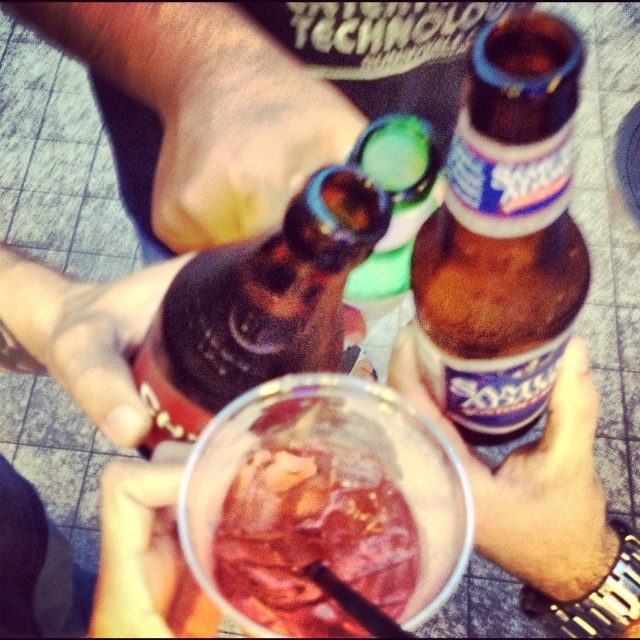
Which is in front, point (572, 474) or point (376, 248)?

Positioned in front is point (572, 474).

Does matte brown bottle at center have a greater width compared to green glass bottle at center?

Correct, the width of matte brown bottle at center exceeds that of green glass bottle at center.

Does point (592, 410) come closer to viewer compared to point (358, 289)?

Yes.

Find the location of `matte brown bottle at center`. matte brown bottle at center is located at coordinates (532, 483).

Is point (506, 401) farther from camera compared to point (410, 531)?

No, it is in front of (410, 531).

Is brown glass bottle at upper center thinner than translucent glass drink at center?

Yes, brown glass bottle at upper center is thinner than translucent glass drink at center.

Does point (470, 76) come farther from viewer compared to point (307, 634)?

No, (470, 76) is in front of (307, 634).

Find the location of a particular element. The width and height of the screenshot is (640, 640). brown glass bottle at upper center is located at coordinates (502, 230).

Between translucent glass drink at center and matte black hand at center, which one has less height?

With less height is translucent glass drink at center.

Can you confirm if translucent glass drink at center is wider than matte black hand at center?

In fact, translucent glass drink at center might be narrower than matte black hand at center.

Is point (340, 508) more distant than point (189, 189)?

Yes, point (340, 508) is behind point (189, 189).

Image resolution: width=640 pixels, height=640 pixels. Find the location of `translucent glass drink at center`. translucent glass drink at center is located at coordinates (312, 540).